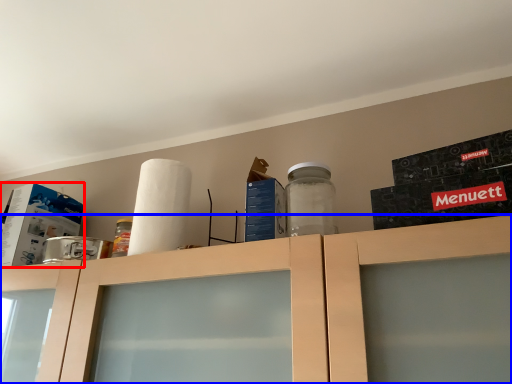
Question: Which of the following is the farthest to the observer, box (highlighted by a red box) or cabinetry (highlighted by a blue box)?

Choices:
 (A) box
 (B) cabinetry

Answer: (A)